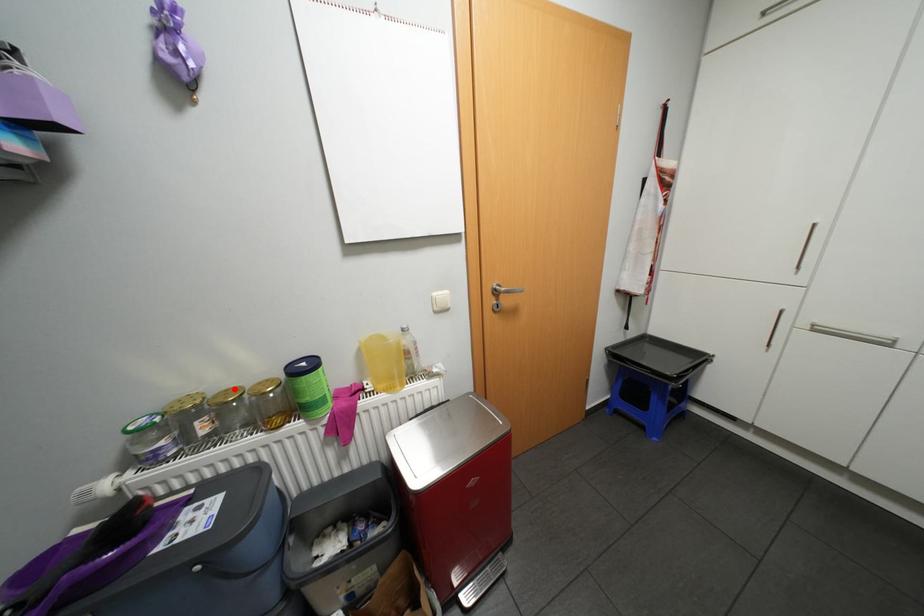
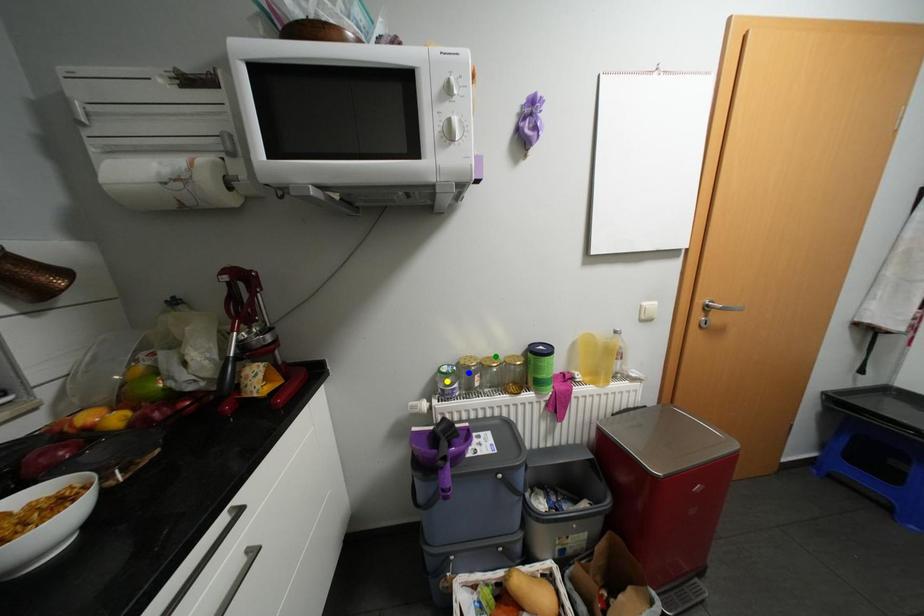
Question: I am providing you with two images of the same scene from different viewpoints. A red point is marked on the first image. You are given multiple points on the second image. In image 2, which mark is for the same physical point as the one in image 1?

Choices:
 (A) green point
 (B) yellow point
 (C) blue point

Answer: (A)